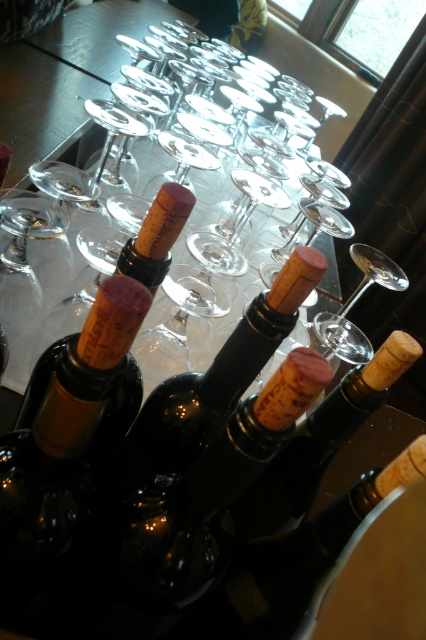
You are a photographer trying to capture a detailed shot of the point at coordinates [403,342]. If your camera is currently positioned 17.66 inches away from this point, is the distance sufficient to focus clearly on the point?

The distance between the point at coordinates [403,342] and the camera is exactly 17.66 inches. Whether this distance is sufficient for clear focus depends on your camera lens specifications and the desired depth of field. However, based on the provided information, the camera is positioned at the correct distance to potentially capture the point clearly.

You are a bartender setting up a table for an event. You need to place a new wine glass on the table without knocking over any existing items. Given the arrangement of the brown corked bottle at center and the clear glass wine glass at center, where should you place the new glass to ensure stability?

The brown corked bottle at center is located below the clear glass wine glass at center. To ensure stability, place the new wine glass away from the existing clear glass wine glass at center to avoid overcrowding and maintain balance.

You are a bartender preparing to arrange a display. You have a brown corked bottle at center and a clear glass wine glass at center. Which object is narrower?

The brown corked bottle at center has a lesser width compared to the clear glass wine glass at center, so the brown corked bottle at center is narrower.